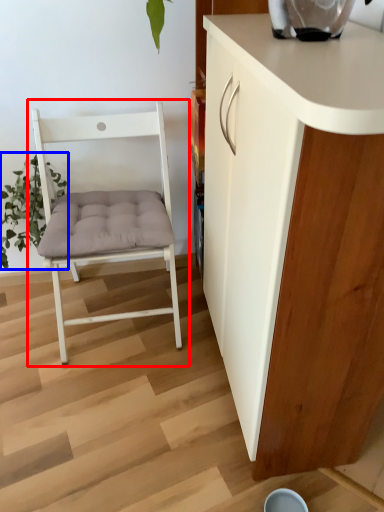
Question: Which point is further to the camera, chair (highlighted by a red box) or plant (highlighted by a blue box)?

Choices:
 (A) chair
 (B) plant

Answer: (B)